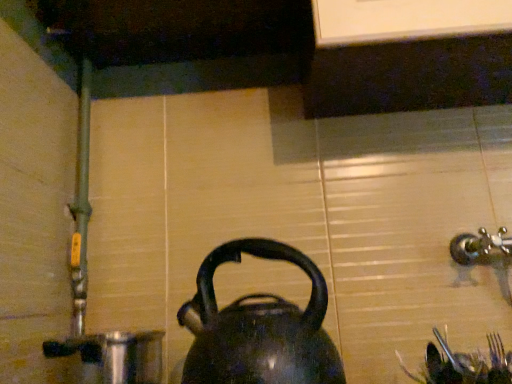
Question: Is shiny black kettle at center oriented away from shiny metallic pot at lower left?

Choices:
 (A) yes
 (B) no

Answer: (B)

Question: From the image's perspective, is shiny black kettle at center over shiny metallic pot at lower left?

Choices:
 (A) yes
 (B) no

Answer: (A)

Question: From a real-world perspective, is shiny black kettle at center on top of shiny metallic pot at lower left?

Choices:
 (A) yes
 (B) no

Answer: (A)

Question: Is shiny black kettle at center located outside shiny metallic pot at lower left?

Choices:
 (A) no
 (B) yes

Answer: (B)

Question: Is shiny black kettle at center behind shiny metallic pot at lower left?

Choices:
 (A) no
 (B) yes

Answer: (A)

Question: Does shiny black kettle at center have a greater height compared to shiny metallic pot at lower left?

Choices:
 (A) no
 (B) yes

Answer: (B)

Question: Can you confirm if shiny metallic pot at lower left is positioned to the right of shiny black kettle at center?

Choices:
 (A) no
 (B) yes

Answer: (A)

Question: Are shiny metallic pot at lower left and shiny black kettle at center making contact?

Choices:
 (A) yes
 (B) no

Answer: (B)

Question: From a real-world perspective, is shiny metallic pot at lower left beneath shiny black kettle at center?

Choices:
 (A) yes
 (B) no

Answer: (A)

Question: Is the depth of shiny metallic pot at lower left less than that of shiny black kettle at center?

Choices:
 (A) no
 (B) yes

Answer: (A)

Question: Can you confirm if shiny metallic pot at lower left is positioned to the left of shiny black kettle at center?

Choices:
 (A) yes
 (B) no

Answer: (A)

Question: Is shiny metallic pot at lower left positioned far away from shiny black kettle at center?

Choices:
 (A) yes
 (B) no

Answer: (B)

Question: Considering their positions, is shiny metallic pot at lower left located in front of or behind shiny black kettle at center?

Choices:
 (A) behind
 (B) front

Answer: (A)